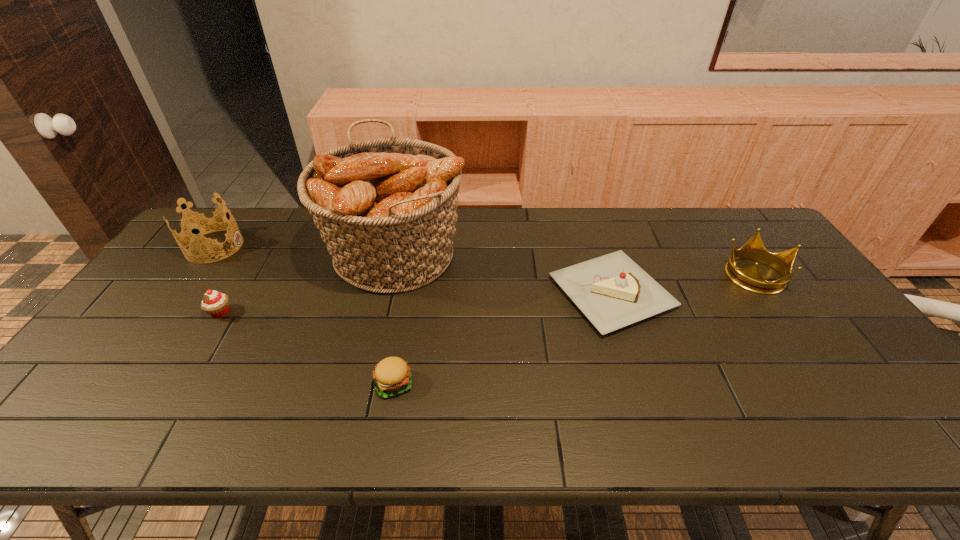
The image size is (960, 540). Identify the location of basket. (386, 208).

Where is `the left crown`? The width and height of the screenshot is (960, 540). the left crown is located at coordinates (203, 225).

This screenshot has width=960, height=540. What are the coordinates of `the second tallest object` in the screenshot? It's located at (203, 225).

Image resolution: width=960 pixels, height=540 pixels. Identify the location of the shorter crown. (749, 278).

The width and height of the screenshot is (960, 540). Find the location of `the rightmost object`. the rightmost object is located at coordinates (749, 278).

Locate an element on the screen. This screenshot has height=540, width=960. cupcake is located at coordinates (216, 304).

Where is `cake`? cake is located at coordinates pyautogui.click(x=612, y=291).

Image resolution: width=960 pixels, height=540 pixels. Find the location of `the shortest object`. the shortest object is located at coordinates (392, 375).

I want to click on the nearest object, so click(392, 375).

Image resolution: width=960 pixels, height=540 pixels. I want to click on vacant region located 0.180m on the right of the basket, so click(523, 253).